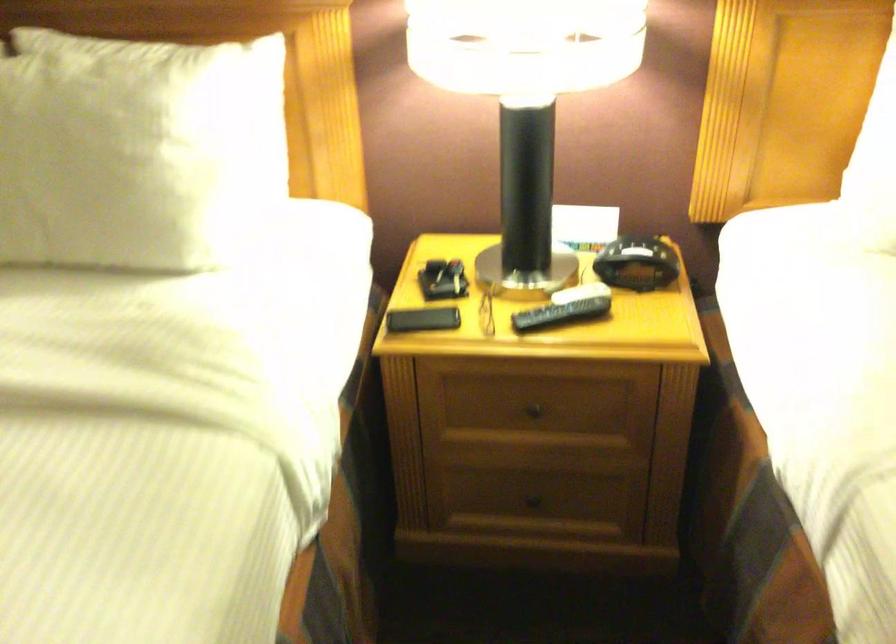
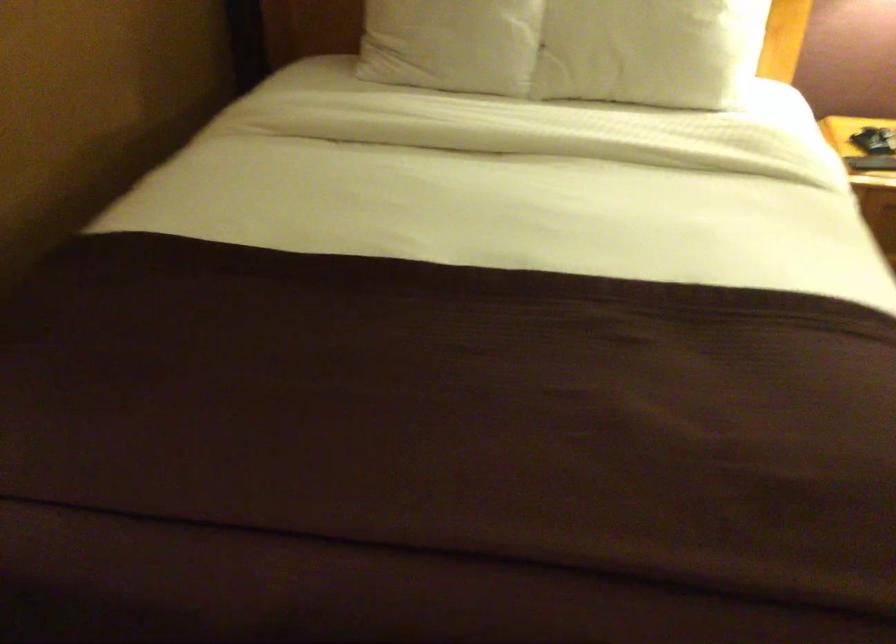
Find the pixel in the second image that matches pixel 76 202 in the first image.

(649, 51)